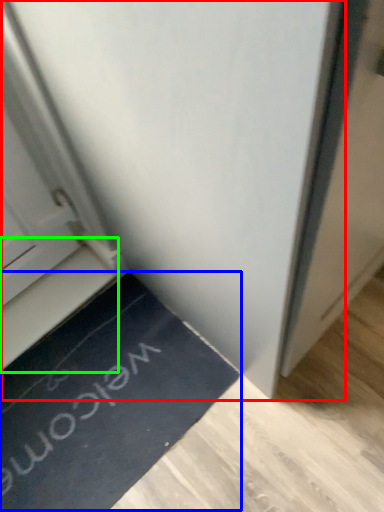
Question: Which object is the closest to the door (highlighted by a red box)? Choose among these: doormat (highlighted by a blue box) or stairwell (highlighted by a green box).

Choices:
 (A) doormat
 (B) stairwell

Answer: (B)